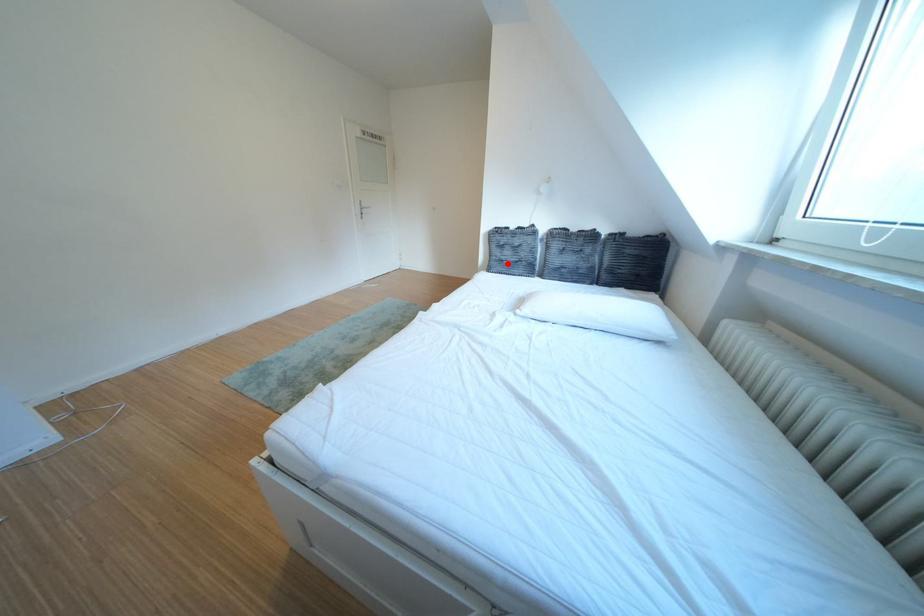
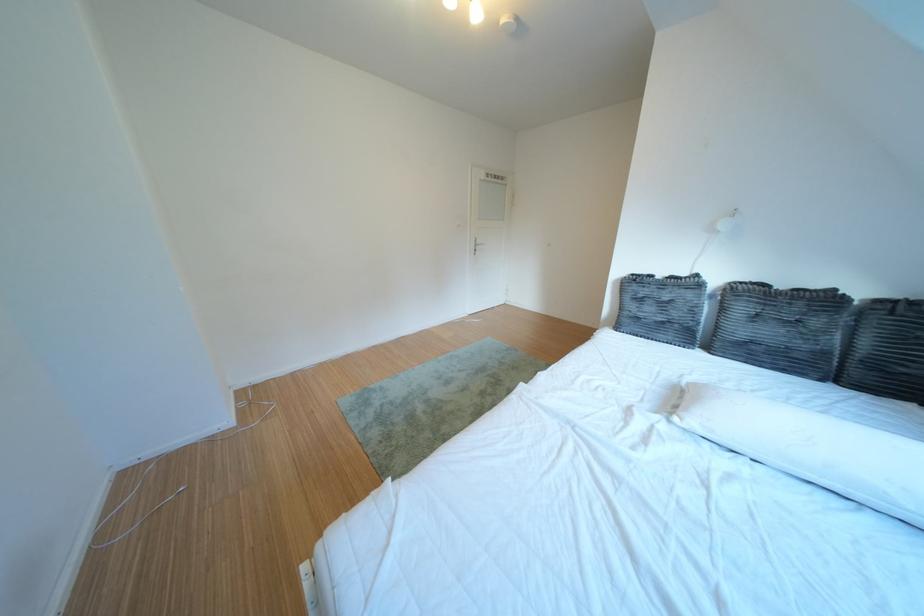
Locate, in the second image, the point that corresponds to the highlighted location in the first image.

(639, 318)